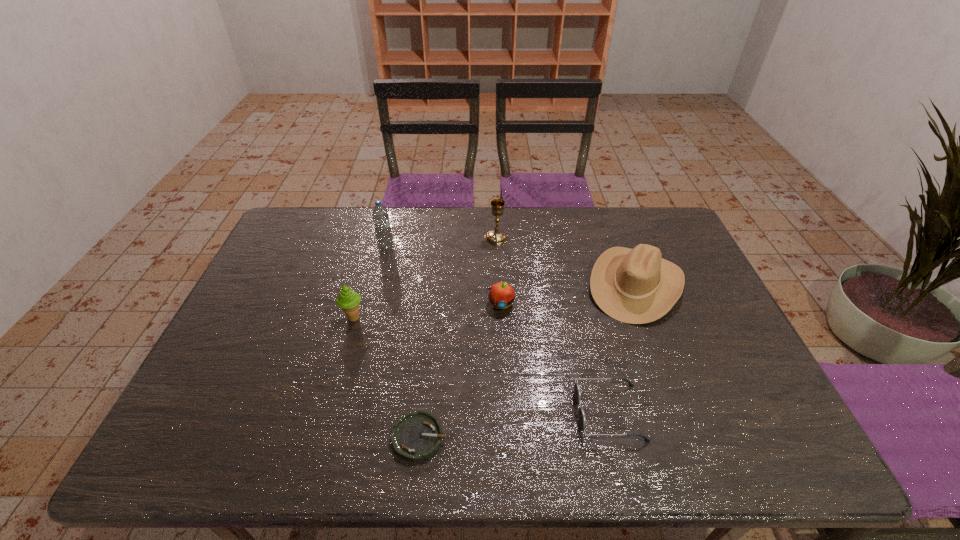
Find the location of a particular element. This screenshot has width=960, height=540. free location that satisfies the following two spatial constraints: 1. on the front side of the water bottle; 2. on the right side of the apple is located at coordinates (372, 304).

The width and height of the screenshot is (960, 540). I want to click on vacant region that satisfies the following two spatial constraints: 1. on the back side of the chalice; 2. on the right side of the icecream, so click(376, 238).

The height and width of the screenshot is (540, 960). Identify the location of vacant space that satisfies the following two spatial constraints: 1. on the back side of the apple; 2. on the left side of the cowboy hat. (499, 285).